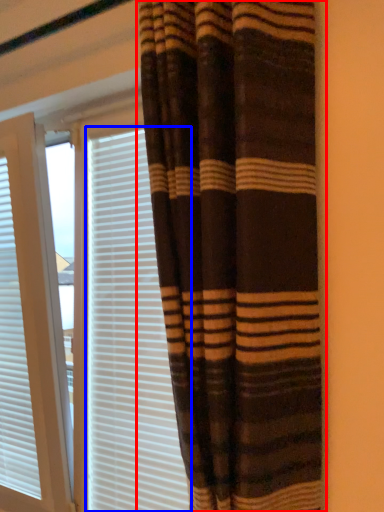
Question: Which object is closer to the camera taking this photo, curtain (highlighted by a red box) or blind (highlighted by a blue box)?

Choices:
 (A) curtain
 (B) blind

Answer: (A)